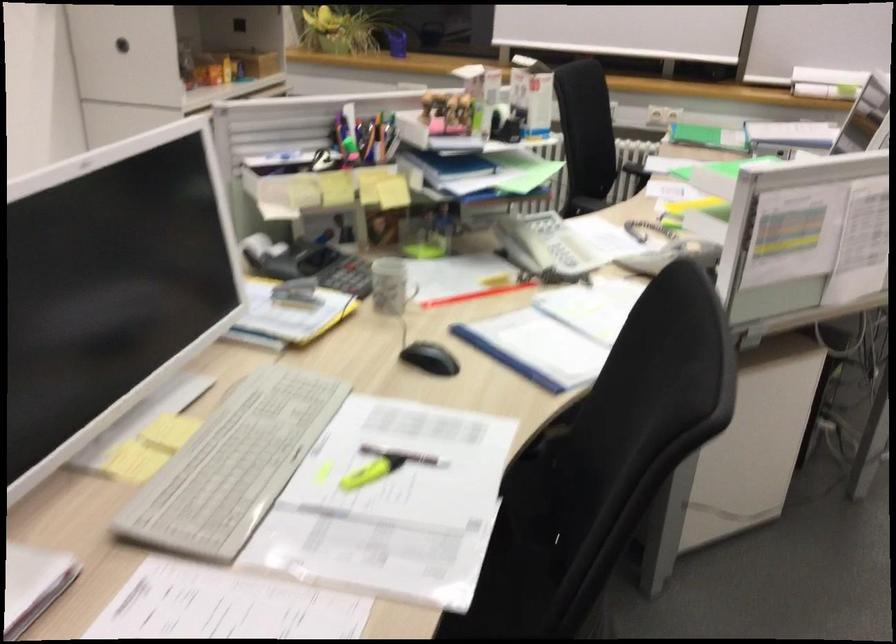
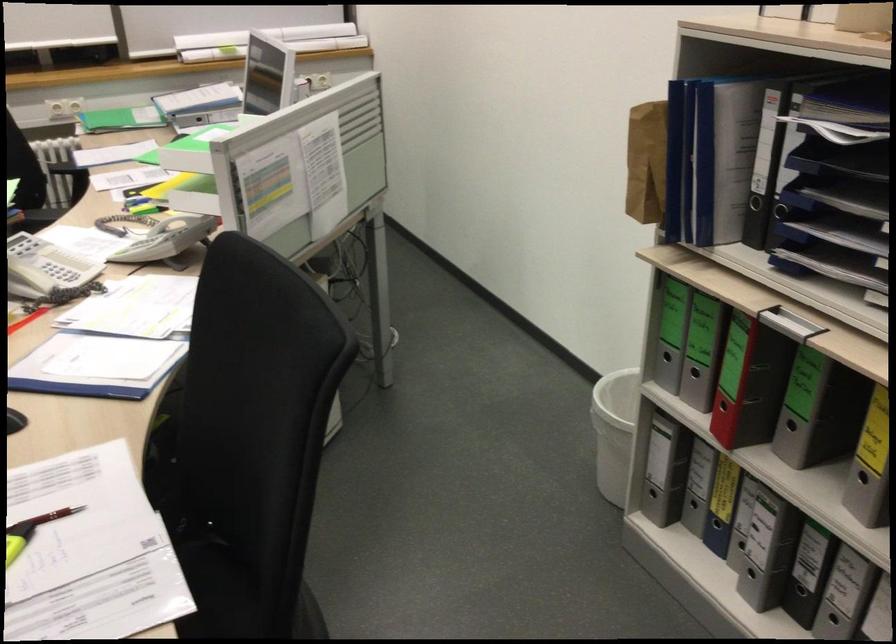
The point at (506, 281) is marked in the first image. Where is the corresponding point in the second image?

(26, 319)